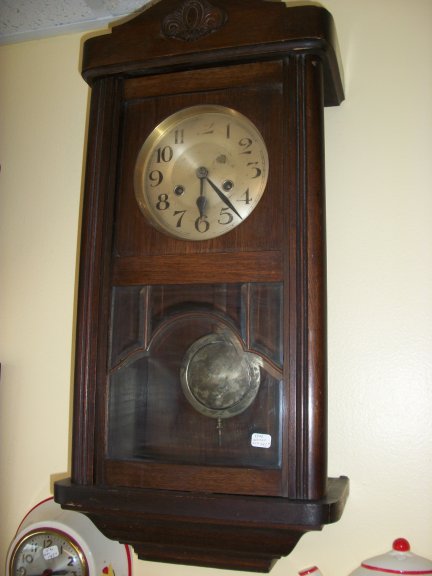
Where is `ceiling`? The height and width of the screenshot is (576, 432). ceiling is located at coordinates 48,18.